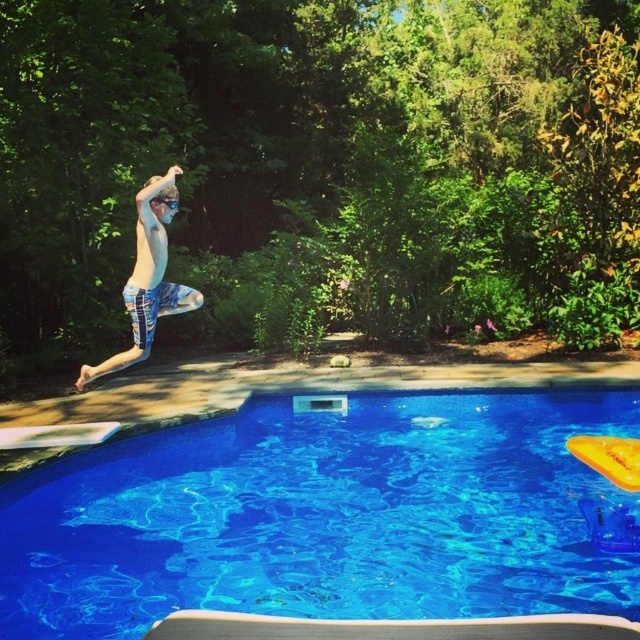
Which is more to the right, blue glossy water at center or blue printed shorts at center?

From the viewer's perspective, blue glossy water at center appears more on the right side.

Between blue glossy water at center and blue printed shorts at center, which one is positioned higher?

blue printed shorts at center is above.

Is point (96, 467) positioned in front of point (147, 257)?

Yes.

You are a GUI agent. You are given a task and a screenshot of the screen. Output one action in this format:
    pyautogui.click(x=<x>, y=<y>)
    Task: Click on the blue glossy water at center
    
    Given the screenshot: What is the action you would take?
    pyautogui.click(x=323, y=515)

Which of these two, blue glossy water at center or black plastic goggles at upper center, stands shorter?

With less height is black plastic goggles at upper center.

Measure the distance between blue glossy water at center and camera.

They are 12.17 feet apart.

Measure the distance between point (554,474) and camera.

They are 18.64 feet apart.

Find the location of `blue glossy water at center`. blue glossy water at center is located at coordinates (323, 515).

Does blue printed shorts at center lie in front of black plastic goggles at upper center?

Yes, blue printed shorts at center is in front of black plastic goggles at upper center.

Who is positioned more to the left, blue printed shorts at center or black plastic goggles at upper center?

blue printed shorts at center

This screenshot has width=640, height=640. Find the location of `blue printed shorts at center`. blue printed shorts at center is located at coordinates (147, 280).

At what (x,y) coordinates should I click in order to perform the action: click on blue printed shorts at center. Please return your answer as a coordinate pair (x, y). Image resolution: width=640 pixels, height=640 pixels. Looking at the image, I should click on (147, 280).